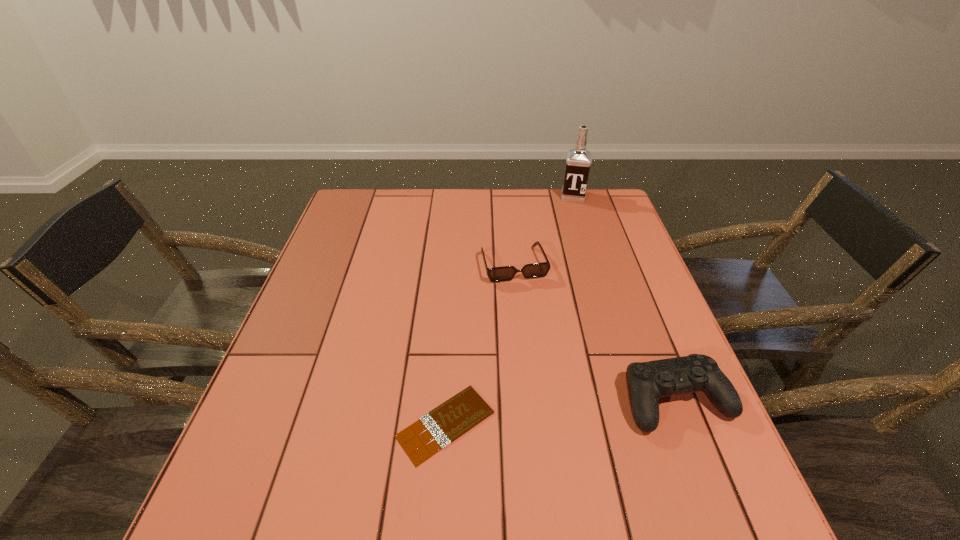
I want to click on the shortest object, so click(x=447, y=422).

Identify the location of the third shortest object. This screenshot has height=540, width=960. (647, 382).

Find the location of a particular element. the tallest object is located at coordinates (578, 161).

You are a GUI agent. You are given a task and a screenshot of the screen. Output one action in this format:
    pyautogui.click(x=<x>, y=<y>)
    Task: Click on the farthest object
    This screenshot has width=960, height=540.
    Given the screenshot: What is the action you would take?
    pyautogui.click(x=578, y=161)

This screenshot has width=960, height=540. I want to click on the third tallest object, so click(535, 270).

Where is `the second farthest object`? The width and height of the screenshot is (960, 540). the second farthest object is located at coordinates (535, 270).

This screenshot has width=960, height=540. I want to click on vacant space located 0.120m on the left of the shortest object, so click(x=335, y=424).

I want to click on free space located 0.310m on the left of the third shortest object, so click(x=472, y=400).

You are a GUI agent. You are given a task and a screenshot of the screen. Output one action in this format:
    pyautogui.click(x=<x>, y=<y>)
    Task: Click on the free space located 0.370m on the front label of the farthest object
    
    Given the screenshot: What is the action you would take?
    pyautogui.click(x=566, y=273)

The image size is (960, 540). I want to click on blank space located 0.290m on the front label of the farthest object, so click(568, 255).